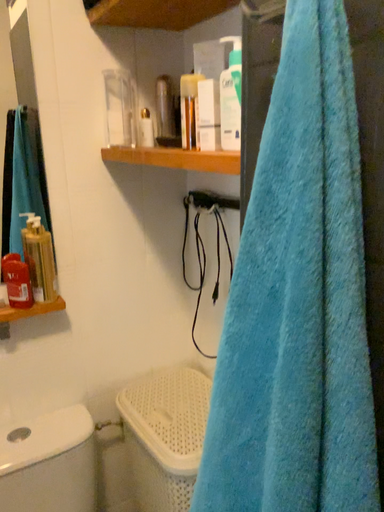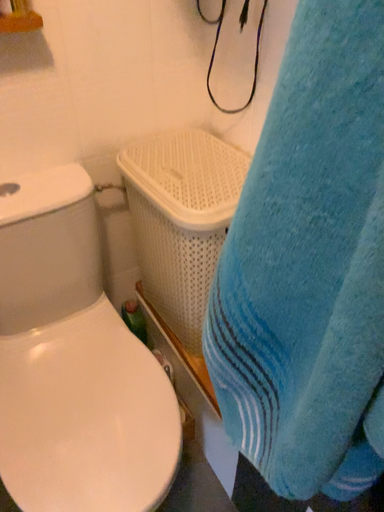
Question: Which way did the camera rotate in the video?

Choices:
 (A) rotated downward
 (B) rotated upward

Answer: (A)